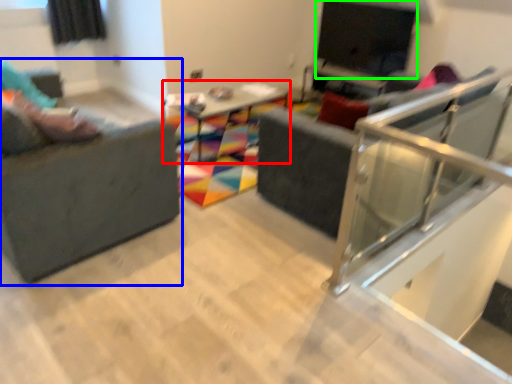
Question: Which object is the closest to the table (highlighted by a red box)? Choose among these: studio couch (highlighted by a blue box) or window screen (highlighted by a green box).

Choices:
 (A) studio couch
 (B) window screen

Answer: (B)